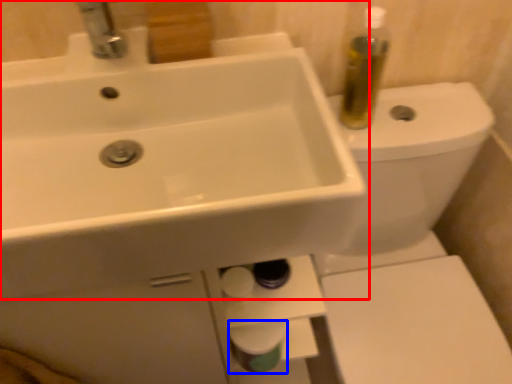
Question: Which object appears closest to the camera in this image, sink (highlighted by a red box) or toilet paper (highlighted by a blue box)?

Choices:
 (A) sink
 (B) toilet paper

Answer: (A)